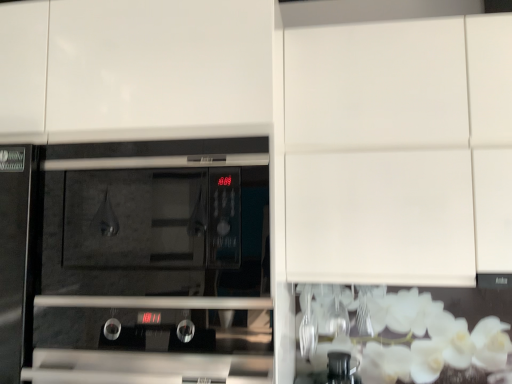
Question: Considering the positions of black glass oven at center and white matte cabinet at upper center in the image, is black glass oven at center wider or thinner than white matte cabinet at upper center?

Choices:
 (A) wide
 (B) thin

Answer: (B)

Question: Do you think black glass oven at center is within white matte cabinet at upper center, or outside of it?

Choices:
 (A) inside
 (B) outside

Answer: (B)

Question: In the image, is black glass oven at center positioned in front of or behind white matte cabinet at upper center?

Choices:
 (A) behind
 (B) front

Answer: (B)

Question: Is point (399, 23) closer or farther from the camera than point (174, 167)?

Choices:
 (A) farther
 (B) closer

Answer: (A)

Question: Considering the positions of white matte cabinet at upper center and black glass oven at center in the image, is white matte cabinet at upper center wider or thinner than black glass oven at center?

Choices:
 (A) wide
 (B) thin

Answer: (A)

Question: Considering the positions of white matte cabinet at upper center and black glass oven at center in the image, is white matte cabinet at upper center bigger or smaller than black glass oven at center?

Choices:
 (A) small
 (B) big

Answer: (B)

Question: Which is correct: white matte cabinet at upper center is inside black glass oven at center, or outside of it?

Choices:
 (A) outside
 (B) inside

Answer: (A)